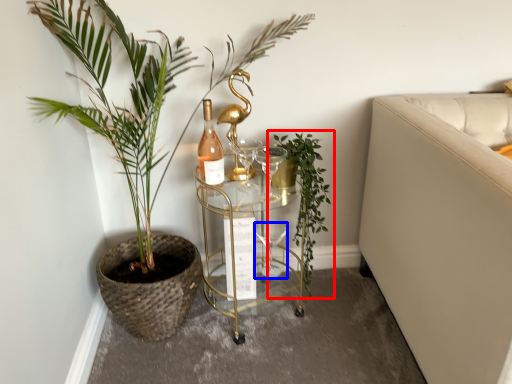
Question: Which point is closer to the camera, houseplant (highlighted by a red box) or wine glass (highlighted by a blue box)?

Choices:
 (A) houseplant
 (B) wine glass

Answer: (A)